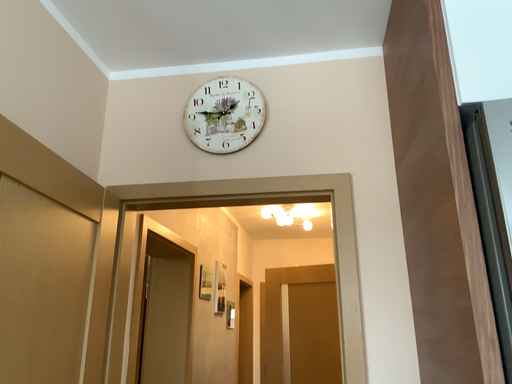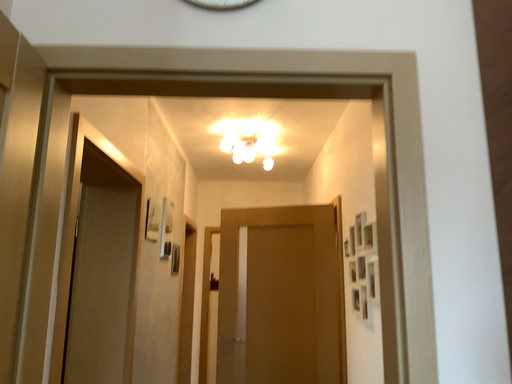
Question: Which way did the camera rotate in the video?

Choices:
 (A) rotated upward
 (B) rotated downward

Answer: (B)